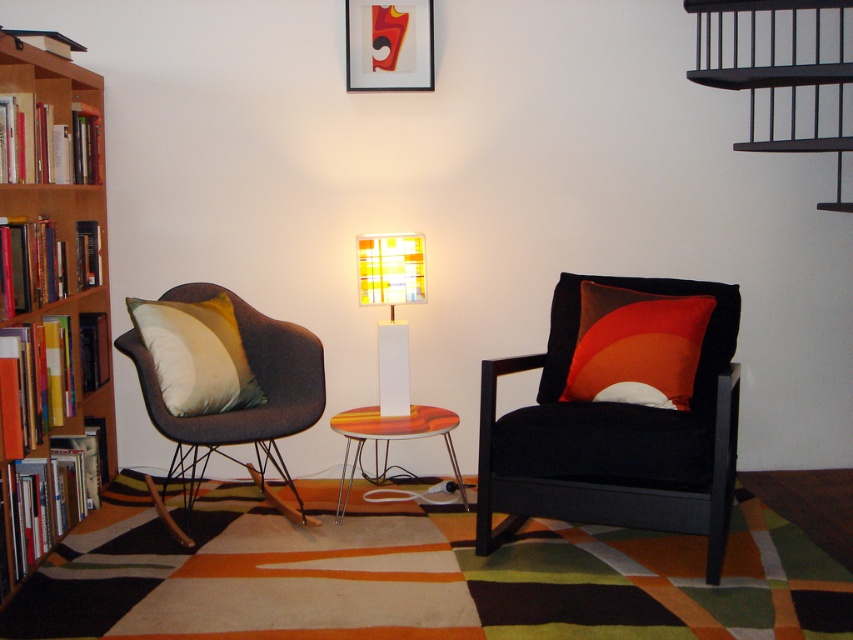
Based on the photo, who is shorter, wooden bookcase at left or black metal stairs at upper right?

Standing shorter between the two is black metal stairs at upper right.

Looking at this image, measure the distance between point [102,406] and camera.

They are 12.36 feet apart.

Image resolution: width=853 pixels, height=640 pixels. I want to click on wooden bookcase at left, so click(x=49, y=300).

Between dark gray fabric swivel chair at left and black metal stairs at upper right, which one is positioned lower?

dark gray fabric swivel chair at left

Does dark gray fabric swivel chair at left have a smaller size compared to black metal stairs at upper right?

Correct, dark gray fabric swivel chair at left occupies less space than black metal stairs at upper right.

Which is behind, point (204, 465) or point (828, 147)?

The point (204, 465) is behind.

Find the location of a particular element. This screenshot has height=640, width=853. dark gray fabric swivel chair at left is located at coordinates (241, 408).

Who is positioned more to the left, black metal stairs at upper right or matte black picture frame at upper center?

matte black picture frame at upper center is more to the left.

Image resolution: width=853 pixels, height=640 pixels. In order to click on black metal stairs at upper right in this screenshot , I will do `click(776, 76)`.

Where is `black metal stairs at upper right`? This screenshot has width=853, height=640. black metal stairs at upper right is located at coordinates (776, 76).